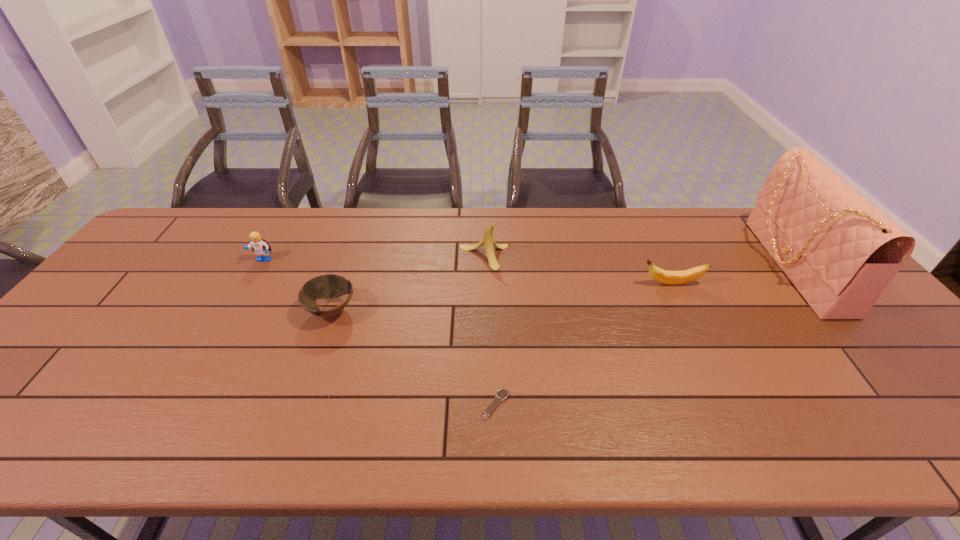
Identify which object is the third nearest to the fifth shortest object. Please provide its 2D coordinates. Your answer should be formatted as a tuple, i.e. [(x, y)], where the tuple contains the x and y coordinates of a point satisfying the conditions above.

[(502, 394)]